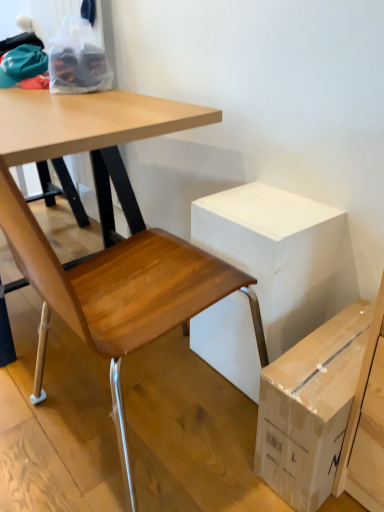
Where is `vacant space situated above brown cardboard box at lower right (from a real-world perspective)`? Image resolution: width=384 pixels, height=512 pixels. vacant space situated above brown cardboard box at lower right (from a real-world perspective) is located at coordinates (329, 352).